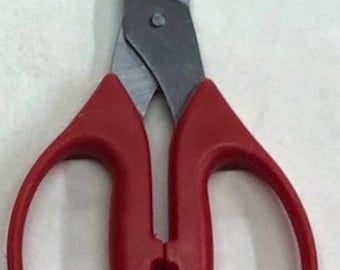
Identify the location of right handle. (191, 191).